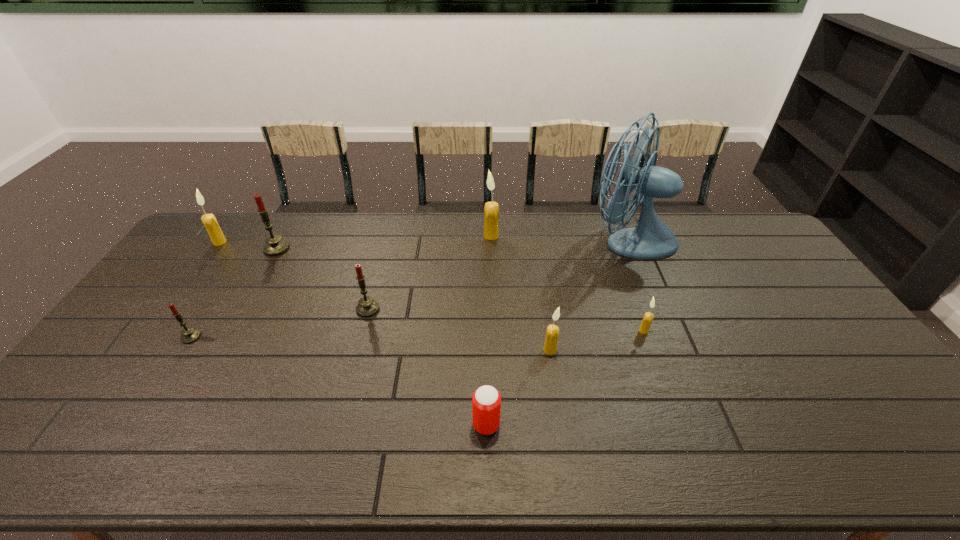
You are a GUI agent. You are given a task and a screenshot of the screen. Output one action in this format:
    pyautogui.click(x=<x>, y=<y>)
    Task: Click on the second nearest object
    
    Given the screenshot: What is the action you would take?
    pyautogui.click(x=552, y=332)

The width and height of the screenshot is (960, 540). I want to click on the second object from left to right, so click(189, 335).

Where is `the second candle from left to right`? This screenshot has width=960, height=540. the second candle from left to right is located at coordinates (189, 335).

At what (x,y) coordinates should I click in order to perform the action: click on the smallest cream candle. Please return your answer as a coordinate pair (x, y). Image resolution: width=960 pixels, height=540 pixels. Looking at the image, I should click on (648, 317).

I want to click on the second nearest cream candle, so click(x=648, y=317).

You are a GUI agent. You are given a task and a screenshot of the screen. Output one action in this format:
    pyautogui.click(x=<x>, y=<y>)
    Task: Click on the beer can
    
    Given the screenshot: What is the action you would take?
    pyautogui.click(x=486, y=402)

In order to click on the nearest object in this screenshot , I will do `click(486, 402)`.

What are the coordinates of `free region located in front of the tallest object to blow air` in the screenshot? It's located at (498, 240).

You are a GUI agent. You are given a task and a screenshot of the screen. Output one action in this format:
    pyautogui.click(x=<x>, y=<y>)
    Task: Click on the vacant region located in front of the tallest object to blow air
    The width and height of the screenshot is (960, 540).
    Given the screenshot: What is the action you would take?
    pyautogui.click(x=550, y=240)

Where is `vacant position located in front of the tallest object to blow air`? vacant position located in front of the tallest object to blow air is located at coordinates (517, 240).